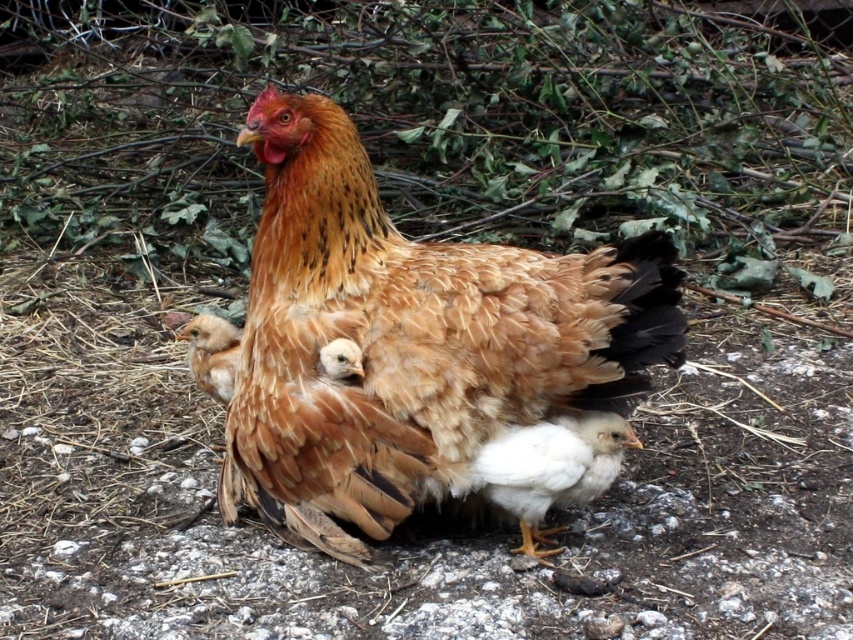
You are a photographer trying to capture a closeup of the brown feathered hen at center. The camera you are using has a focus point at coordinate point (409, 340). Will this focus point align with the hen?

Yes, the focus point at coordinate point (409, 340) aligns with the brown feathered hen at center as the point marks exactly where the hen is located.